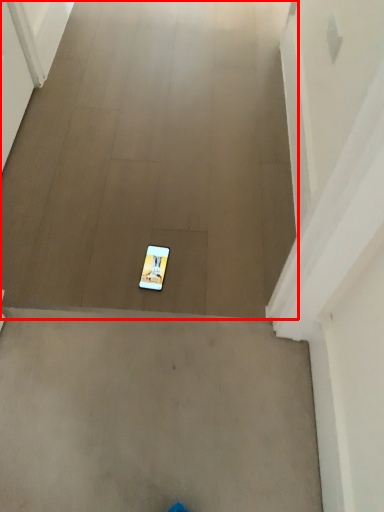
Question: Observing the image, what is the correct spatial positioning of concrete (annotated by the red box) in reference to mobile phone?

Choices:
 (A) right
 (B) left

Answer: (B)